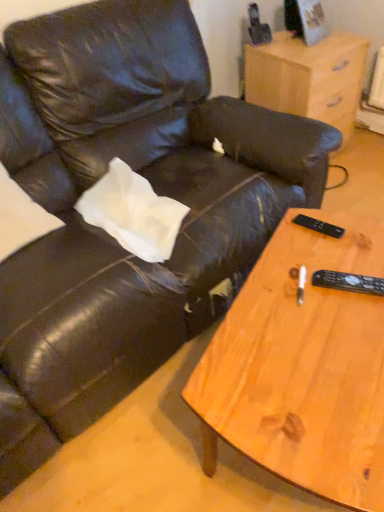
Question: Is black plastic remote at right, the first remote from the bottom, to the right of light wood/finely finished nightstand at upper right from the viewer's perspective?

Choices:
 (A) no
 (B) yes

Answer: (A)

Question: Does black plastic remote at right, acting as the 2th remote starting from the back, have a smaller size compared to light wood/finely finished nightstand at upper right?

Choices:
 (A) yes
 (B) no

Answer: (A)

Question: Is black plastic remote at right, acting as the 2th remote starting from the back, aimed at light wood/finely finished nightstand at upper right?

Choices:
 (A) no
 (B) yes

Answer: (A)

Question: Is black plastic remote at right, arranged as the 2th remote when viewed from the top, in contact with light wood/finely finished nightstand at upper right?

Choices:
 (A) no
 (B) yes

Answer: (A)

Question: Is the depth of black plastic remote at right, the first remote from the front, greater than that of light wood/finely finished nightstand at upper right?

Choices:
 (A) no
 (B) yes

Answer: (A)

Question: Is the position of black plastic remote at right, acting as the 2th remote starting from the back, less distant than that of light wood/finely finished nightstand at upper right?

Choices:
 (A) no
 (B) yes

Answer: (B)

Question: From a real-world perspective, is black plastic remote at right, the first remote from the bottom, beneath black plastic remote at right, the first remote viewed from the back?

Choices:
 (A) no
 (B) yes

Answer: (A)

Question: From a real-world perspective, is black plastic remote at right, arranged as the 2th remote when viewed from the top, physically above black plastic remote at right, the first remote viewed from the back?

Choices:
 (A) yes
 (B) no

Answer: (A)

Question: Is black plastic remote at right, arranged as the 2th remote when viewed from the top, outside black plastic remote at right, the second remote from the front?

Choices:
 (A) no
 (B) yes

Answer: (B)

Question: Are black plastic remote at right, acting as the 2th remote starting from the back, and black plastic remote at right, the second remote from the front, located far from each other?

Choices:
 (A) yes
 (B) no

Answer: (B)

Question: Does black plastic remote at right, acting as the 2th remote starting from the back, have a lesser width compared to black plastic remote at right, the second remote from the front?

Choices:
 (A) no
 (B) yes

Answer: (A)

Question: Is black plastic remote at right, acting as the 2th remote starting from the back, in contact with black plastic remote at right, the first remote viewed from the back?

Choices:
 (A) yes
 (B) no

Answer: (B)

Question: Is wooden coffee table at lower right at the right side of black plastic remote at right, acting as the 2th remote starting from the back?

Choices:
 (A) yes
 (B) no

Answer: (B)